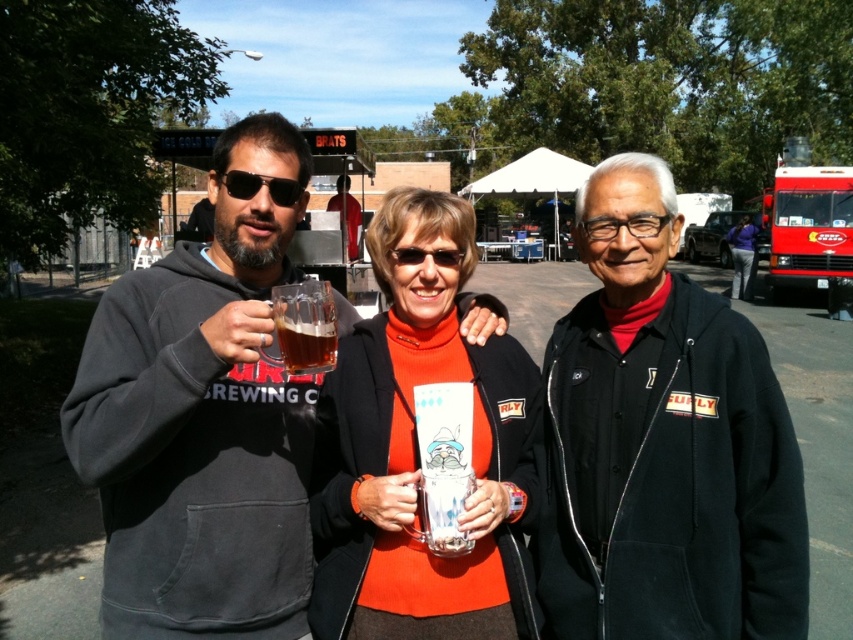
You are standing at the point marked as point (x=663, y=444) in the image. What object is directly beneath your feet?

The point (x=663, y=444) is on black matte jacket at center, so the object directly beneath your feet is the black matte jacket at center.